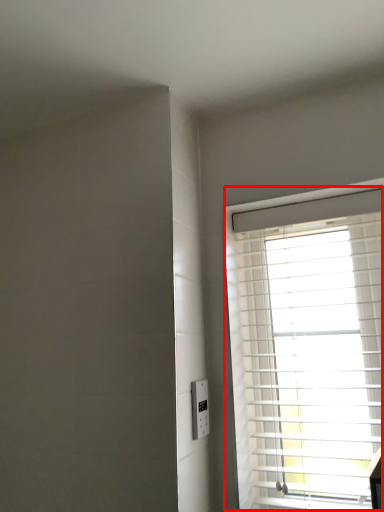
Question: Where is window (annotated by the red box) located in relation to electric outlet in the image?

Choices:
 (A) left
 (B) right

Answer: (B)